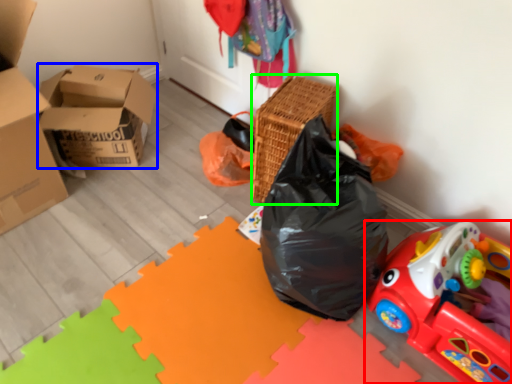
Question: Considering the real-world distances, which object is farthest from toy (highlighted by a red box)? box (highlighted by a blue box) or basket (highlighted by a green box)?

Choices:
 (A) box
 (B) basket

Answer: (A)